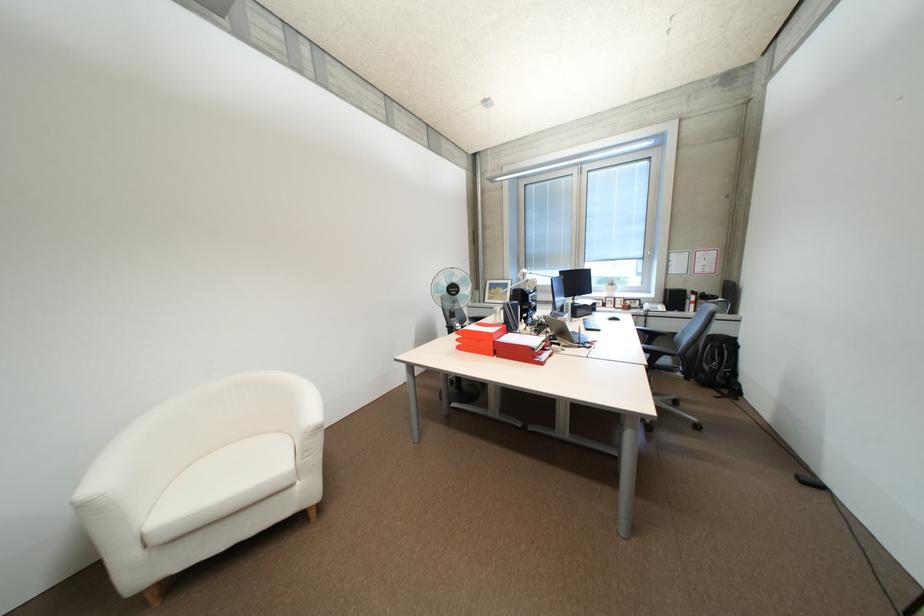
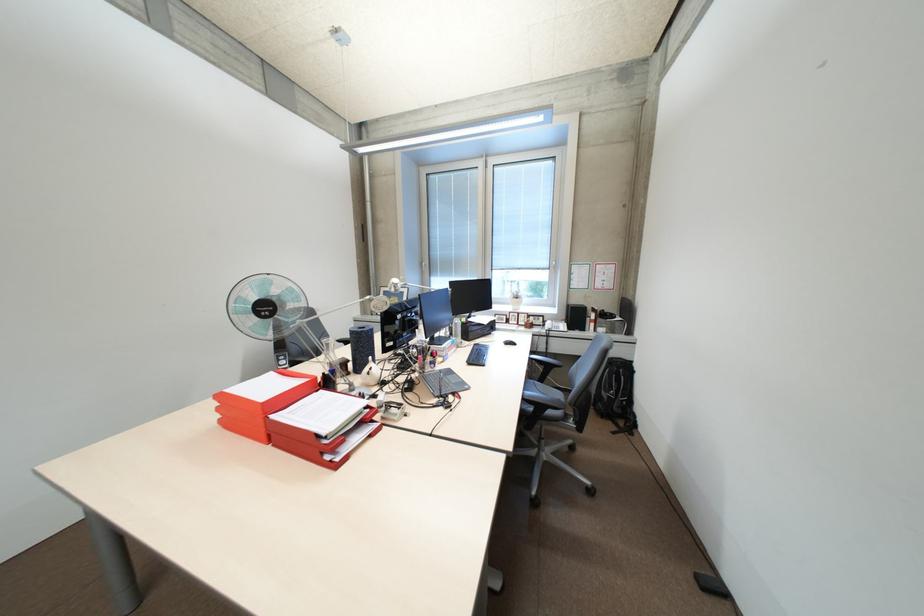
Locate, in the second image, the point that corresponds to [468,346] in the first image.

(231, 421)